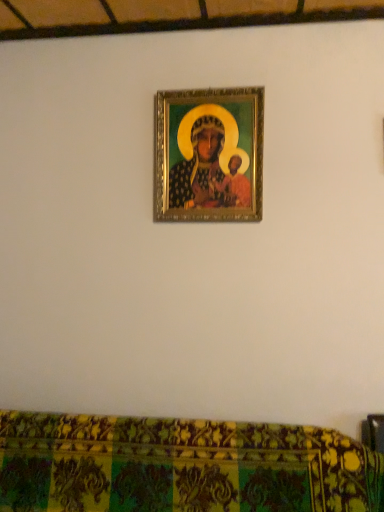
Locate an element on the screen. This screenshot has height=512, width=384. green textured fabric at lower center is located at coordinates (181, 466).

The width and height of the screenshot is (384, 512). Describe the element at coordinates (181, 466) in the screenshot. I see `green textured fabric at lower center` at that location.

At what (x,y) coordinates should I click in order to perform the action: click on green textured fabric at lower center. Please return your answer as a coordinate pair (x, y). Looking at the image, I should click on (181, 466).